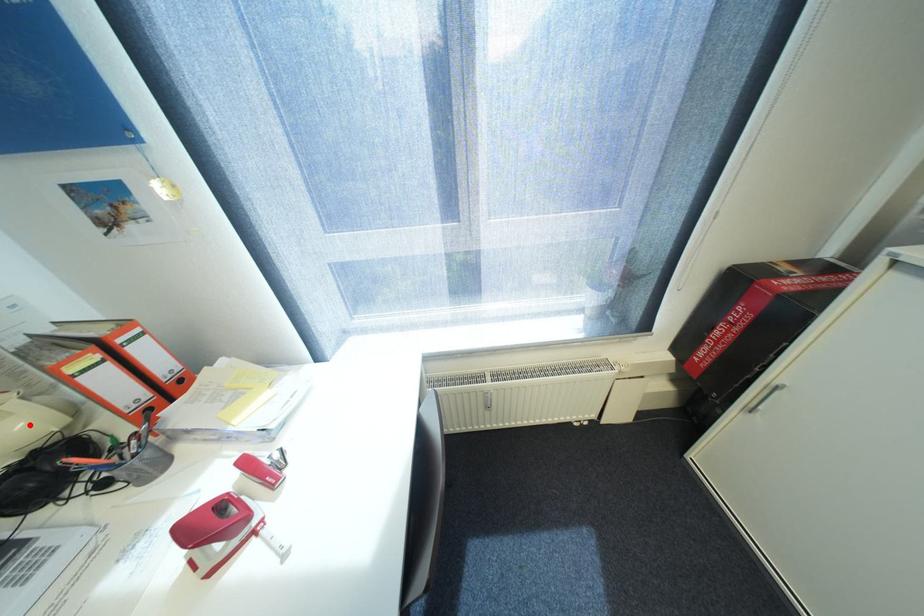
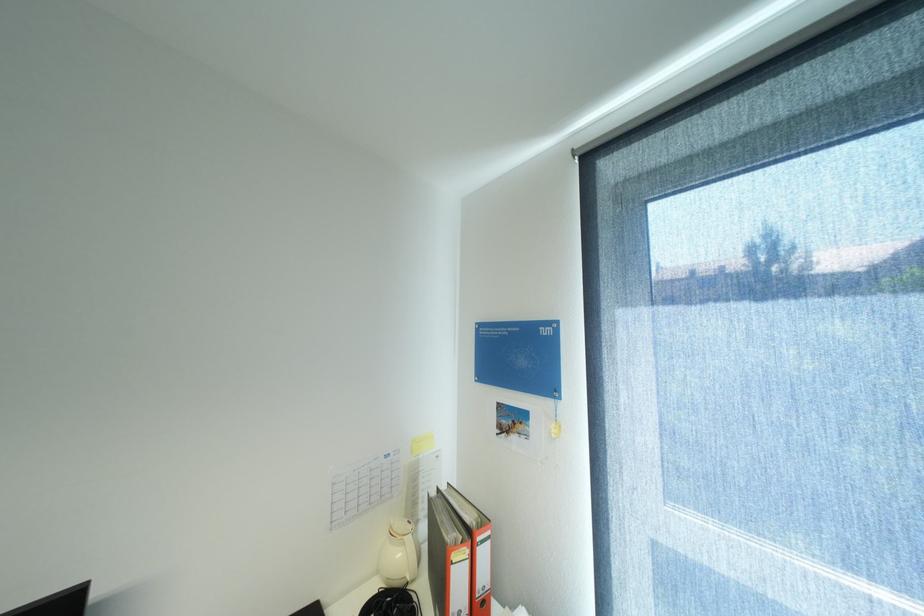
The point at the highlighted location is marked in the first image. Where is the corresponding point in the second image?

(407, 554)